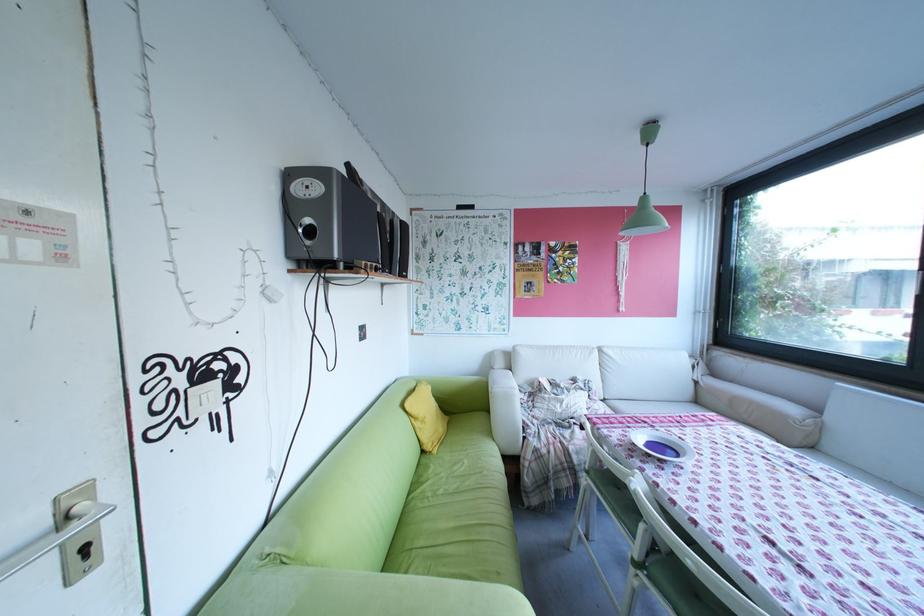
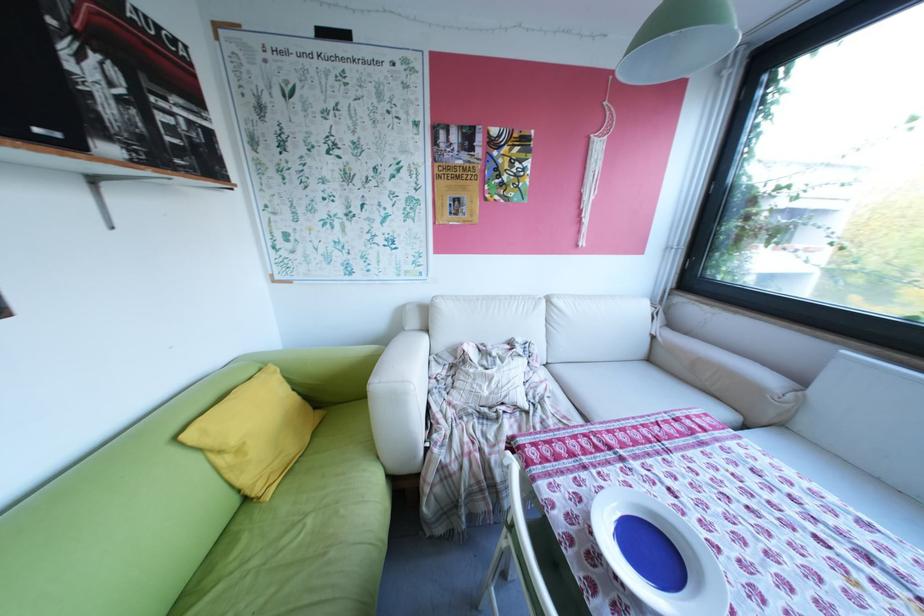
What movement of the cameraman would produce the second image?

The cameraman walked toward right, forward.